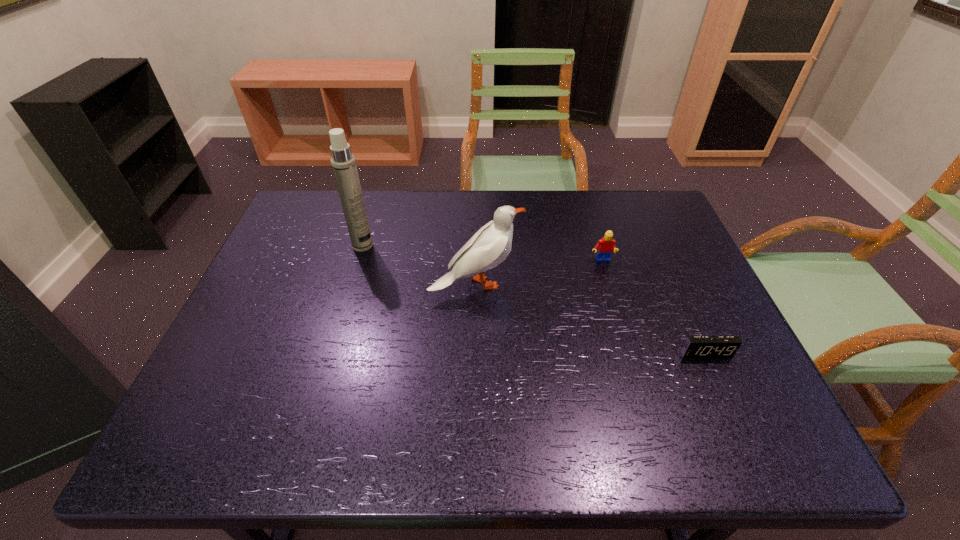
You are a GUI agent. You are given a task and a screenshot of the screen. Output one action in this format:
    pyautogui.click(x=<x>, y=<y>)
    Task: Click on the vacant space that satisfies the following two spatial constraints: 1. on the front-facing side of the third object from left to right; 2. at the beak of the gull
    This screenshot has height=540, width=960.
    Given the screenshot: What is the action you would take?
    pyautogui.click(x=609, y=284)

This screenshot has width=960, height=540. I want to click on free region that satisfies the following two spatial constraints: 1. on the front-facing side of the second shortest object; 2. at the beak of the third object from right to left, so click(x=609, y=284).